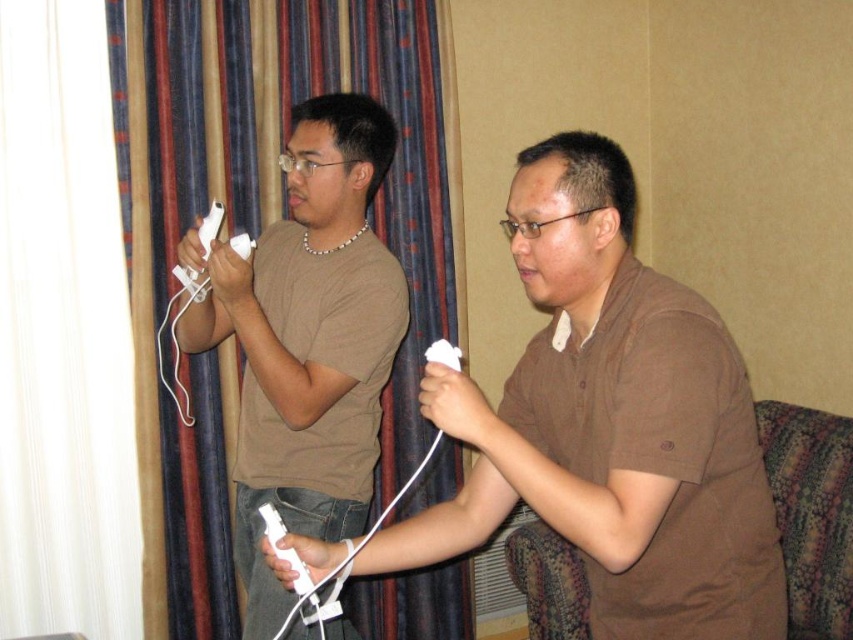
You are a game developer observing the scene. You need to determine if the brown matte shirt at center is positioned higher than the white matte remote at center. Can you confirm this?

The brown matte shirt at center is located above the white matte remote at center, so yes, the brown matte shirt at center is positioned higher than the white matte remote at center.

In the scene shown: You are a game developer analyzing the image to ensure all controllers are visible. The brown matte shirt at center and the white matte remote at center are in the scene. Which object is higher in the image?

The brown matte shirt at center is taller than the white matte remote at center, so the brown matte shirt at center is higher in the image.

You are a photographer standing in front of the brown matte shirt at center. You want to take a clear photo of it. What is the minimum distance you should be from the shirt to ensure the camera can focus properly?

The minimum distance you should be from the brown matte shirt at center is 1.09 meters because the camera requires at least that distance to focus properly.